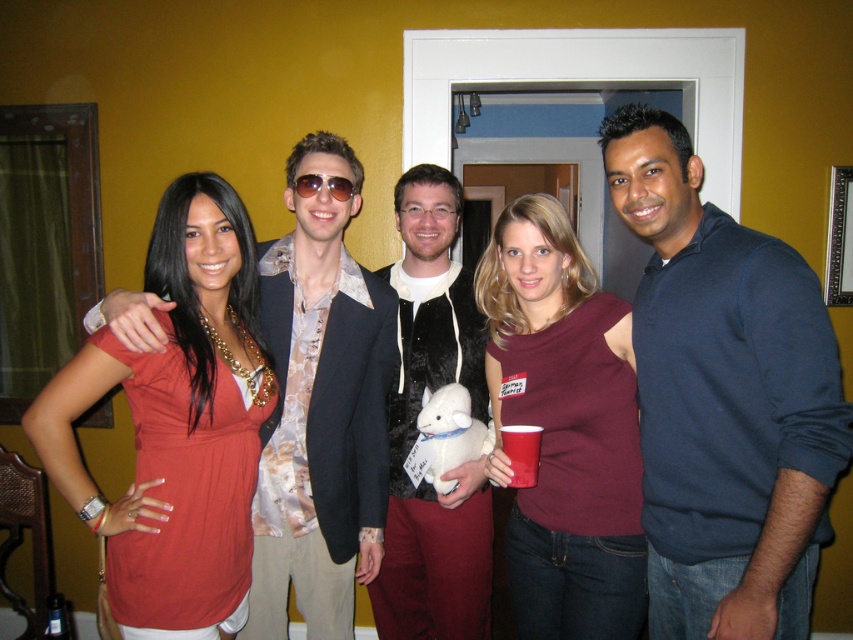
You are standing in the room and want to find the dark blue sweater at center. According to the coordinates provided, where should you look?

You should look at point 0.623 on the x axis and 0.850 on the y axis to find the dark blue sweater at center.

You are organizing a clothing donation drive and need to know which of the two items at the center of the image is narrower to fit into a smaller donation box. The items are the dark blue sweater at center and the matte orange blouse at center. Which one is narrower?

The dark blue sweater at center is narrower than the matte orange blouse at center, so it will fit into the smaller donation box.